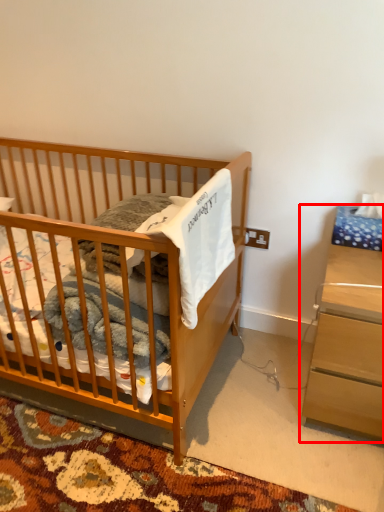
Question: In this image, where is nightstand (annotated by the red box) located relative to infant bed?

Choices:
 (A) right
 (B) left

Answer: (A)